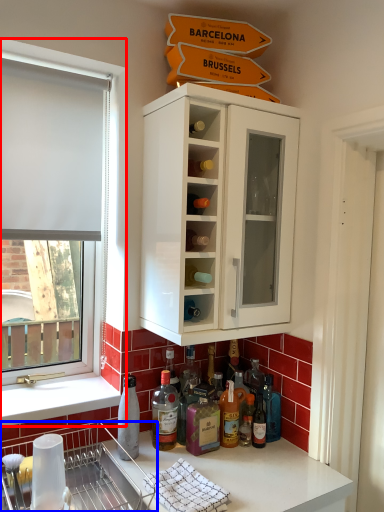
Question: Which of the following is the closest to the observer, window (highlighted by a red box) or dish washer (highlighted by a blue box)?

Choices:
 (A) window
 (B) dish washer

Answer: (B)